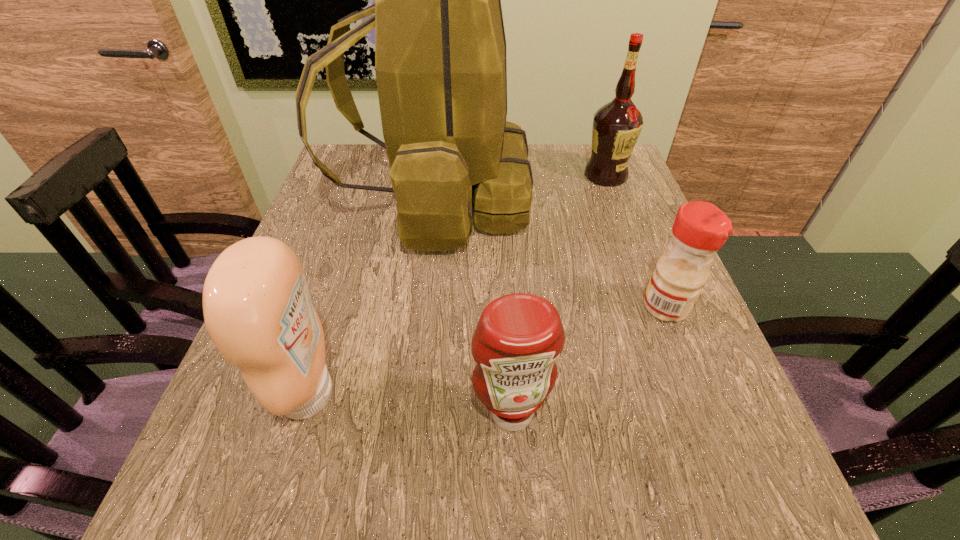
In the image, there is a desktop. Identify the location of vacant region at the near edge. The height and width of the screenshot is (540, 960). tap(515, 520).

Find the location of a particular element. This screenshot has width=960, height=540. vacant space at the left edge of the desktop is located at coordinates (361, 231).

Locate an element on the screen. The width and height of the screenshot is (960, 540). free space at the right edge of the desktop is located at coordinates (684, 372).

The image size is (960, 540). I want to click on vacant space at the far left corner of the desktop, so click(x=376, y=145).

Identify the location of free space between the second condiment from right to left and the third farthest object. (588, 360).

Locate an element on the screen. vacant area that lies between the farthest condiment and the tallest object is located at coordinates (550, 253).

The image size is (960, 540). Identify the location of free space between the third shortest object and the second condiment from left to right. (410, 403).

The width and height of the screenshot is (960, 540). In order to click on free space between the second condiment from left to right and the rightmost condiment in this screenshot , I will do `click(588, 360)`.

The height and width of the screenshot is (540, 960). What are the coordinates of `free space between the rightmost condiment and the second condiment from left to right` in the screenshot? It's located at (588, 360).

What are the coordinates of `free point between the farthest condiment and the backpack` in the screenshot? It's located at (550, 253).